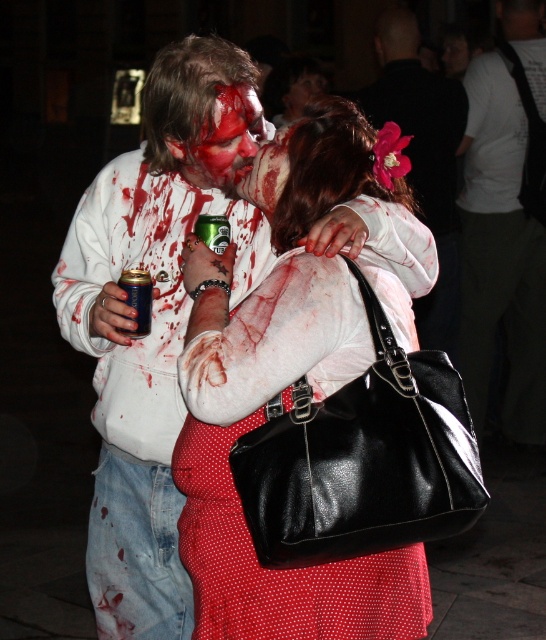
Can you confirm if matte white blouse at center is wider than shiny black hair at upper center?

Indeed, matte white blouse at center has a greater width compared to shiny black hair at upper center.

What do you see at coordinates (289, 397) in the screenshot?
I see `matte white blouse at center` at bounding box center [289, 397].

You are a GUI agent. You are given a task and a screenshot of the screen. Output one action in this format:
    pyautogui.click(x=<x>, y=<y>)
    Task: Click on the matte white blouse at center
    The height and width of the screenshot is (640, 546).
    Given the screenshot: What is the action you would take?
    coord(289,397)

Is point (264, 285) positioned before point (204, 241)?

Yes.

Looking at this image, can you confirm if matte white blouse at center is bigger than green metallic can at center?

Yes, matte white blouse at center is bigger than green metallic can at center.

Describe the element at coordinates (289, 397) in the screenshot. I see `matte white blouse at center` at that location.

Locate an element on the screen. matte white blouse at center is located at coordinates 289,397.

Measure the distance between blood-stained face at center and camera.

They are 7.92 feet apart.

Based on the photo, which is more to the right, blood-stained face at center or smooth skin face at center?

smooth skin face at center is more to the right.

Find the location of a particular element. The image size is (546, 640). blood-stained face at center is located at coordinates (223, 140).